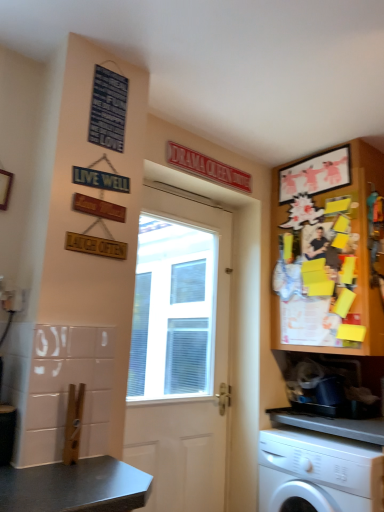
Question: Is white wooden door at center completely or partially inside white plastic washing machine at lower right?

Choices:
 (A) no
 (B) yes

Answer: (A)

Question: Is white plastic washing machine at lower right further to camera compared to white wooden door at center?

Choices:
 (A) no
 (B) yes

Answer: (A)

Question: Is white plastic washing machine at lower right oriented towards white wooden door at center?

Choices:
 (A) yes
 (B) no

Answer: (B)

Question: From a real-world perspective, is white plastic washing machine at lower right positioned under white wooden door at center based on gravity?

Choices:
 (A) no
 (B) yes

Answer: (B)

Question: Is white plastic washing machine at lower right at the right side of white wooden door at center?

Choices:
 (A) yes
 (B) no

Answer: (A)

Question: Considering the relative positions of wooden bulletin board at upper right and white plastic washing machine at lower right in the image provided, is wooden bulletin board at upper right to the left or to the right of white plastic washing machine at lower right?

Choices:
 (A) right
 (B) left

Answer: (A)

Question: Looking at their shapes, would you say wooden bulletin board at upper right is wider or thinner than white plastic washing machine at lower right?

Choices:
 (A) thin
 (B) wide

Answer: (B)

Question: From a real-world perspective, is wooden bulletin board at upper right above or below white plastic washing machine at lower right?

Choices:
 (A) above
 (B) below

Answer: (A)

Question: Considering the positions of point (283, 186) and point (367, 482), is point (283, 186) closer or farther from the camera than point (367, 482)?

Choices:
 (A) closer
 (B) farther

Answer: (B)

Question: From the image's perspective, is white wooden door at center located above or below wooden bulletin board at upper right?

Choices:
 (A) below
 (B) above

Answer: (A)

Question: Would you say white wooden door at center is inside or outside wooden bulletin board at upper right?

Choices:
 (A) inside
 (B) outside

Answer: (B)

Question: Visually, is white wooden door at center positioned to the left or to the right of wooden bulletin board at upper right?

Choices:
 (A) right
 (B) left

Answer: (B)

Question: In terms of height, does white wooden door at center look taller or shorter compared to wooden bulletin board at upper right?

Choices:
 (A) short
 (B) tall

Answer: (B)

Question: Is point (317, 462) positioned closer to the camera than point (340, 238)?

Choices:
 (A) closer
 (B) farther

Answer: (A)

Question: From the image's perspective, is white plastic washing machine at lower right located above or below wooden bulletin board at upper right?

Choices:
 (A) below
 (B) above

Answer: (A)